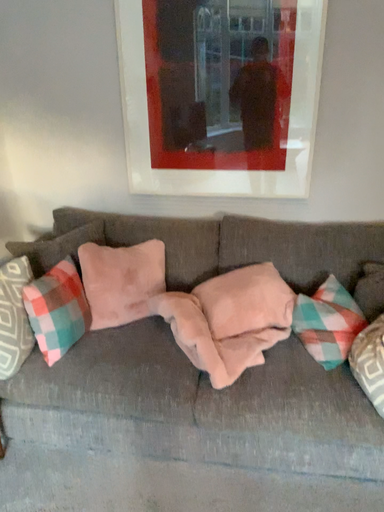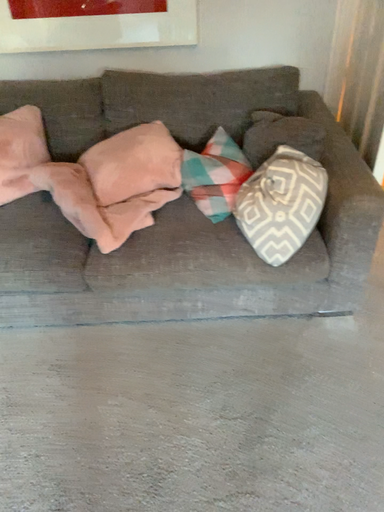
Question: How did the camera likely rotate when shooting the video?

Choices:
 (A) rotated upward
 (B) rotated downward

Answer: (B)